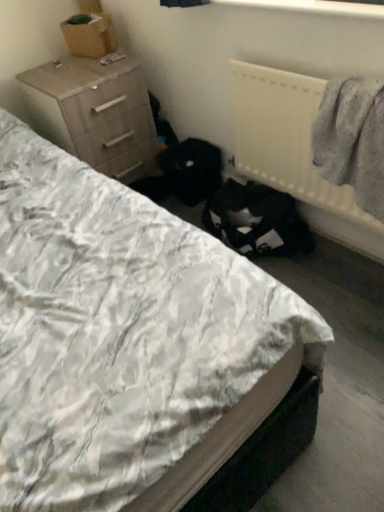
Question: From a real-world perspective, does white quilted bed at center sit lower than gray woolen sweater at right?

Choices:
 (A) yes
 (B) no

Answer: (A)

Question: Is white quilted bed at center further to camera compared to gray woolen sweater at right?

Choices:
 (A) yes
 (B) no

Answer: (B)

Question: From a real-world perspective, is white quilted bed at center on top of gray woolen sweater at right?

Choices:
 (A) yes
 (B) no

Answer: (B)

Question: Is white quilted bed at center closer to the viewer compared to gray woolen sweater at right?

Choices:
 (A) yes
 (B) no

Answer: (A)

Question: From the image's perspective, is white quilted bed at center over gray woolen sweater at right?

Choices:
 (A) yes
 (B) no

Answer: (B)

Question: From the image's perspective, would you say white quilted bed at center is shown under gray woolen sweater at right?

Choices:
 (A) yes
 (B) no

Answer: (A)

Question: Can you confirm if white quilted bed at center is positioned to the left of light brown wood chest of drawers at upper left?

Choices:
 (A) no
 (B) yes

Answer: (B)

Question: Can you confirm if white quilted bed at center is taller than light brown wood chest of drawers at upper left?

Choices:
 (A) yes
 (B) no

Answer: (A)

Question: Is white quilted bed at center located outside light brown wood chest of drawers at upper left?

Choices:
 (A) no
 (B) yes

Answer: (B)

Question: Is white quilted bed at center at the right side of light brown wood chest of drawers at upper left?

Choices:
 (A) no
 (B) yes

Answer: (A)

Question: Does white quilted bed at center turn towards light brown wood chest of drawers at upper left?

Choices:
 (A) no
 (B) yes

Answer: (A)

Question: Is white quilted bed at center looking in the opposite direction of light brown wood chest of drawers at upper left?

Choices:
 (A) yes
 (B) no

Answer: (B)

Question: Is white plastic radiator at upper right taller than light brown wood chest of drawers at upper left?

Choices:
 (A) yes
 (B) no

Answer: (B)